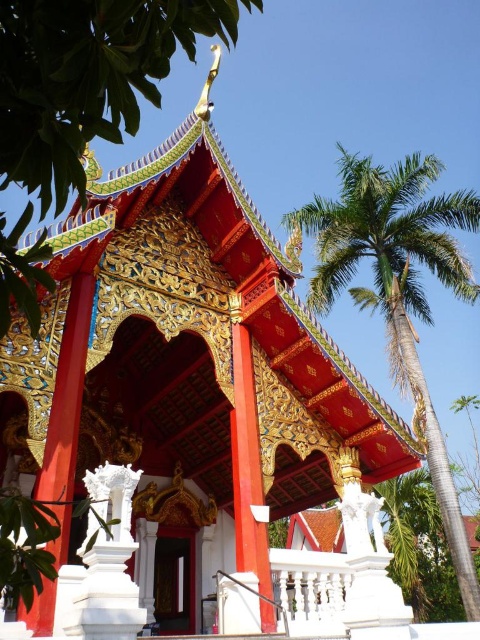
You are a photographer planning to capture the traditional Thai temple with both the green glossy tree at upper center and the green leafy palm tree at upper right in the frame. Which tree should you position closer to the edges of the frame to ensure both fit without overcrowding?

You should position the green glossy tree at upper center closer to the edges of the frame because its width is less than the green leafy palm tree at upper right, allowing it to take up less space while still including both in the composition.

You are a drone operator tasked with capturing aerial footage of the temple. You need to fly your drone from the green glossy tree at upper center to the green leafy palm tree at upper right. Given that your drone has a maximum flight range of 150 feet, will it be able to reach the destination without recharging?

The distance between the green glossy tree at upper center and the green leafy palm tree at upper right is 174.88 feet. Since the drone can only fly up to 150 feet without recharging, it will not be able to reach the destination without needing to recharge.

You are standing in front of the temple and want to take a photo that includes both the green glossy tree at upper center and the green leafy palm tree at upper right. Which tree should you position closer to the front of your photo to ensure both are in frame?

You should position the green glossy tree at upper center closer to the front of your photo because it is closer to the viewer than the green leafy palm tree at upper right, ensuring both are visible in the frame.